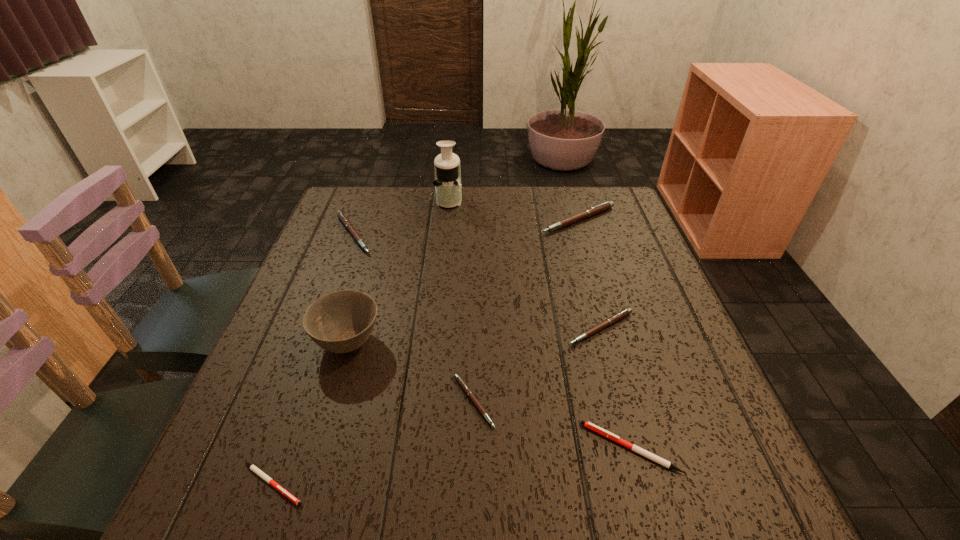
You are a GUI agent. You are given a task and a screenshot of the screen. Output one action in this format:
    pyautogui.click(x=<x>, y=<y>)
    Task: Click on the pink pen that stands as the second closest to the fifth object from left to right
    
    Given the screenshot: What is the action you would take?
    pyautogui.click(x=342, y=217)

Identify the location of free space that satisfies the following two spatial constraints: 1. at the nib of the third tallest object; 2. at the nib of the smallest pink pen. (633, 402).

Identify the location of vacant space that satisfies the following two spatial constraints: 1. at the nib of the biggest pink pen; 2. on the clicker of the shortest pen. (657, 484).

Where is `vacant area in the image that satisfies the following two spatial constraints: 1. at the nib of the third farthest pen; 2. on the clicker of the smaller white pen`? The image size is (960, 540). vacant area in the image that satisfies the following two spatial constraints: 1. at the nib of the third farthest pen; 2. on the clicker of the smaller white pen is located at coordinates (643, 484).

Locate an element on the screen. free space that satisfies the following two spatial constraints: 1. at the nib of the sixth shortest object; 2. at the nib of the third pink pen from right to left is located at coordinates (633, 402).

I want to click on blank space that satisfies the following two spatial constraints: 1. at the nib of the sixth shortest object; 2. at the nib of the nearest pink pen, so click(633, 402).

Find the location of a particular element. The height and width of the screenshot is (540, 960). free point that satisfies the following two spatial constraints: 1. at the nib of the biggest pink pen; 2. at the nib of the smallest pink pen is located at coordinates (633, 402).